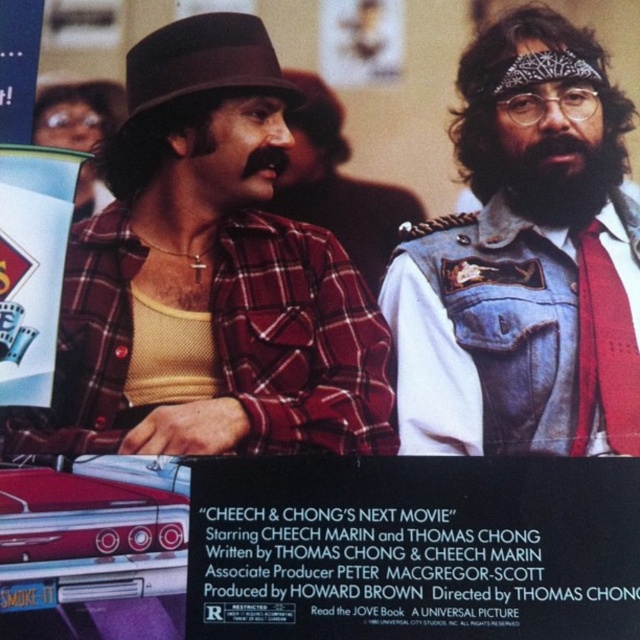
You are a photographer standing 1.5 meters away from the camera. You want to place a black paper at lower center in the scene. Can you reach it without moving your feet?

The black paper at lower center is 1.01 meters from camera. Since you are standing 1.5 meters away from the camera, you cannot reach it without moving your feet.

From the picture: Looking at the promotional poster for the Cheech and Chong movie, you notice the black paper at lower center and the brown felt fedora at upper left. Which object is positioned lower in the image?

The black paper at lower center is positioned lower in the image than the brown felt fedora at upper left.

In the movie poster featuring Cheech and Chong, you notice a black paper at lower center and a plaid shirt at center. Which object is positioned lower in the image?

The black paper at lower center is positioned lower than the plaid shirt at center.